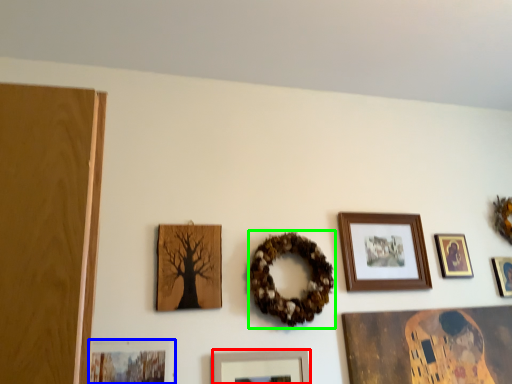
Question: Which object is positioned closest to picture frame (highlighted by a red box)? Select from picture frame (highlighted by a blue box) and decor (highlighted by a green box).

Choices:
 (A) picture frame
 (B) decor

Answer: (B)